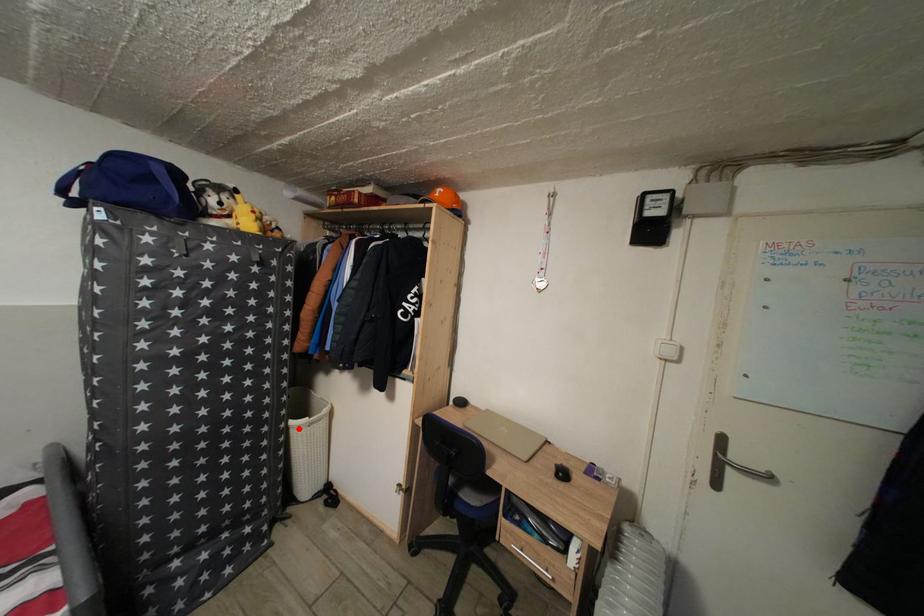
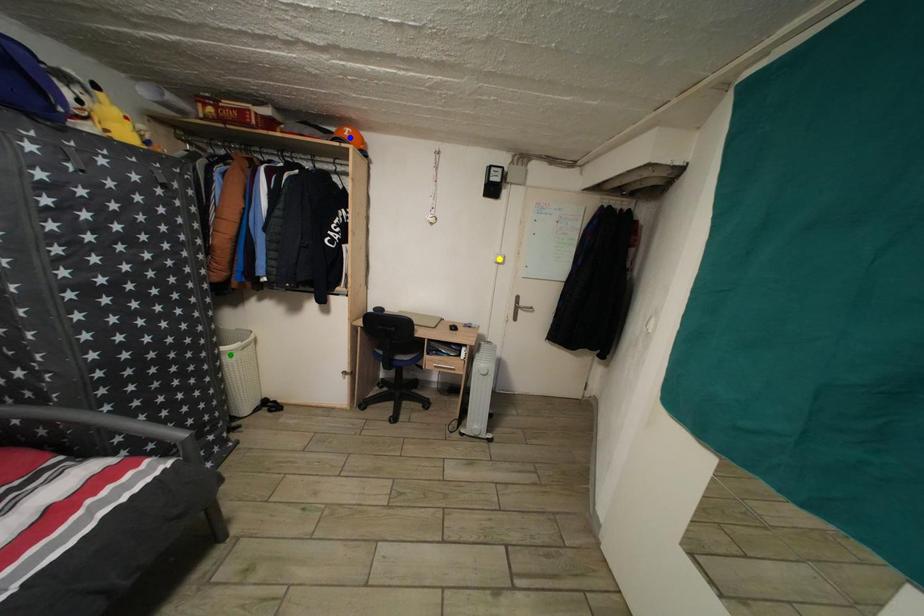
Question: I am providing you with two images of the same scene from different viewpoints. A red point is marked on the first image. You are given multiple points on the second image. Which point in image 2 is actually the same real-world point as the red point in image 1?

Choices:
 (A) green point
 (B) blue point
 (C) yellow point

Answer: (A)